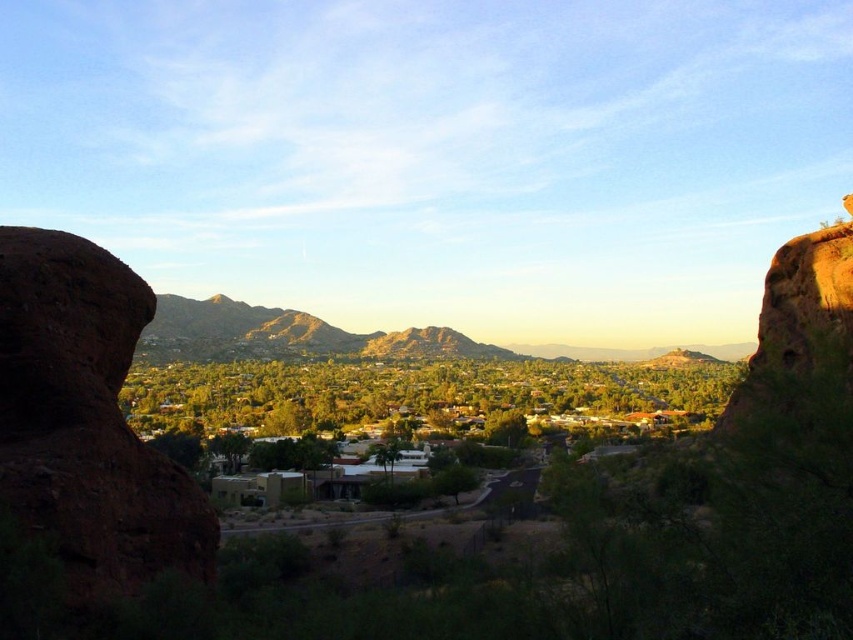
Question: Does brown rough rock at left have a smaller size compared to green grassy valley at center?

Choices:
 (A) yes
 (B) no

Answer: (A)

Question: Based on their relative distances, which object is nearer to the green grassy valley at center?

Choices:
 (A) rustic brown mountain at center
 (B) brown rough rock at left

Answer: (A)

Question: Which is farther from the green grassy valley at center?

Choices:
 (A) brown rough rock at left
 (B) rustic brown mountain at center

Answer: (A)

Question: Does brown rough rock at left have a lesser width compared to green grassy valley at center?

Choices:
 (A) no
 (B) yes

Answer: (B)

Question: Is brown rough rock at left behind rustic brown mountain at center?

Choices:
 (A) yes
 (B) no

Answer: (B)

Question: Which object is positioned farthest from the rustic brown mountain at center?

Choices:
 (A) brown rough rock at left
 (B) green grassy valley at center

Answer: (A)